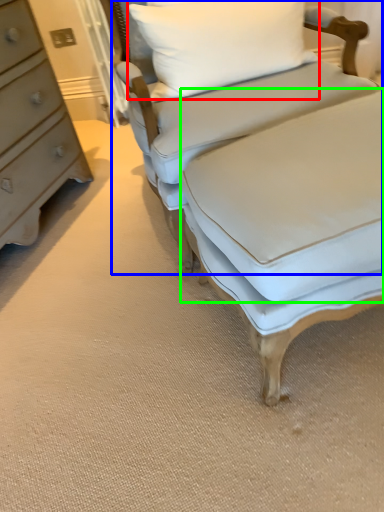
Question: Estimate the real-world distances between objects in this image. Which object is farther from pillow (highlighted by a red box), studio couch (highlighted by a blue box) or sheet (highlighted by a green box)?

Choices:
 (A) studio couch
 (B) sheet

Answer: (B)